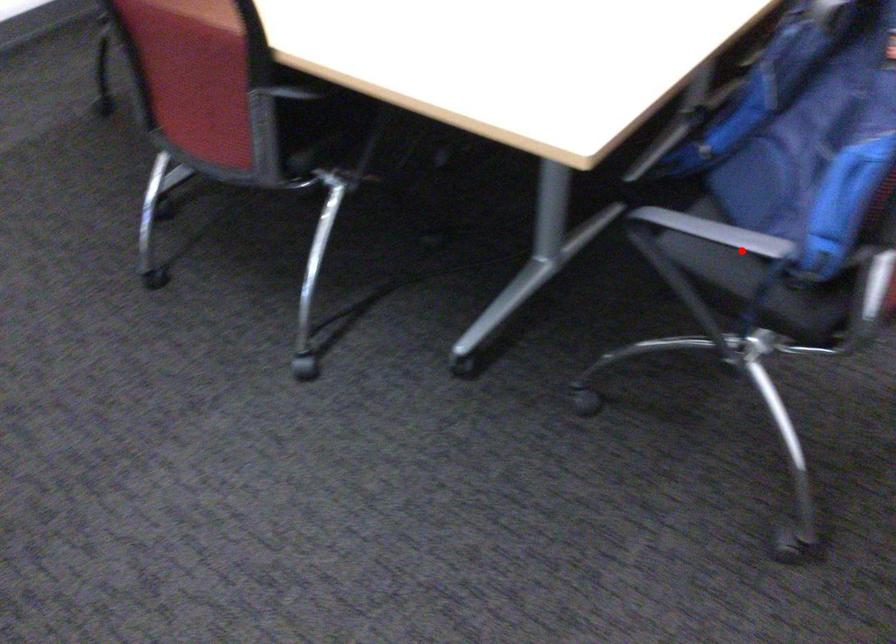
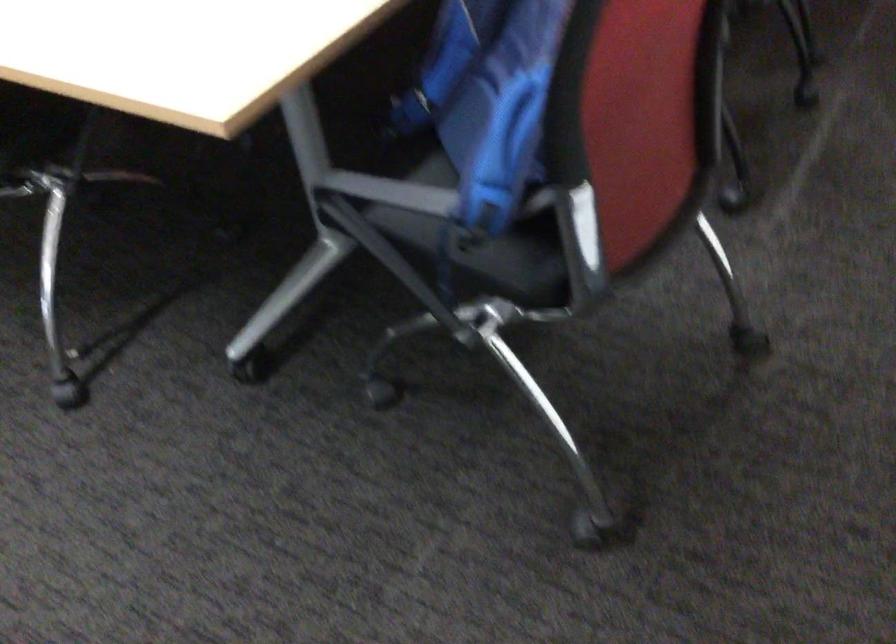
Locate, in the second image, the point that corresponds to the highlighted location in the first image.

(416, 207)